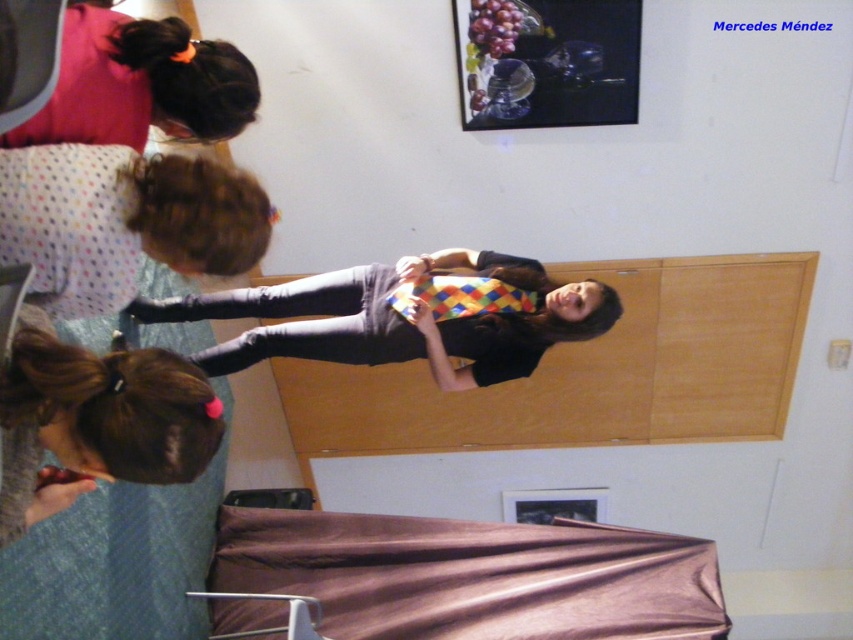
Question: Based on their relative distances, which object is farther from the brown hair at upper left?

Choices:
 (A) matte black hair at upper left
 (B) polka dot fabric at upper left
 (C) multicolored fabric tie at center
 (D) brown satin bed at lower center

Answer: (D)

Question: Which point is farther from the camera taking this photo?

Choices:
 (A) (194, 83)
 (B) (20, 371)

Answer: (A)

Question: Considering the relative positions of multicolored fabric tie at center and matte black hair at upper left in the image provided, where is multicolored fabric tie at center located with respect to matte black hair at upper left?

Choices:
 (A) below
 (B) above

Answer: (A)

Question: Is multicolored fabric tie at center below brown hair at upper left?

Choices:
 (A) no
 (B) yes

Answer: (A)

Question: Which of these objects is positioned closest to the brown satin bed at lower center?

Choices:
 (A) matte black hair at upper left
 (B) multicolored fabric tie at center
 (C) polka dot fabric at upper left

Answer: (B)

Question: Is brown satin bed at lower center below polka dot fabric at upper left?

Choices:
 (A) no
 (B) yes

Answer: (B)